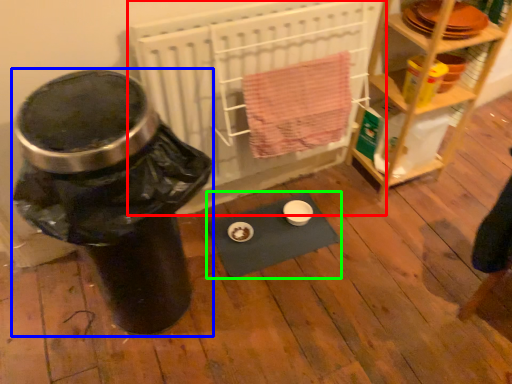
Question: Considering the real-world distances, which object is farthest from wide (highlighted by a red box)? water cooler (highlighted by a blue box) or yoga mat (highlighted by a green box)?

Choices:
 (A) water cooler
 (B) yoga mat

Answer: (A)